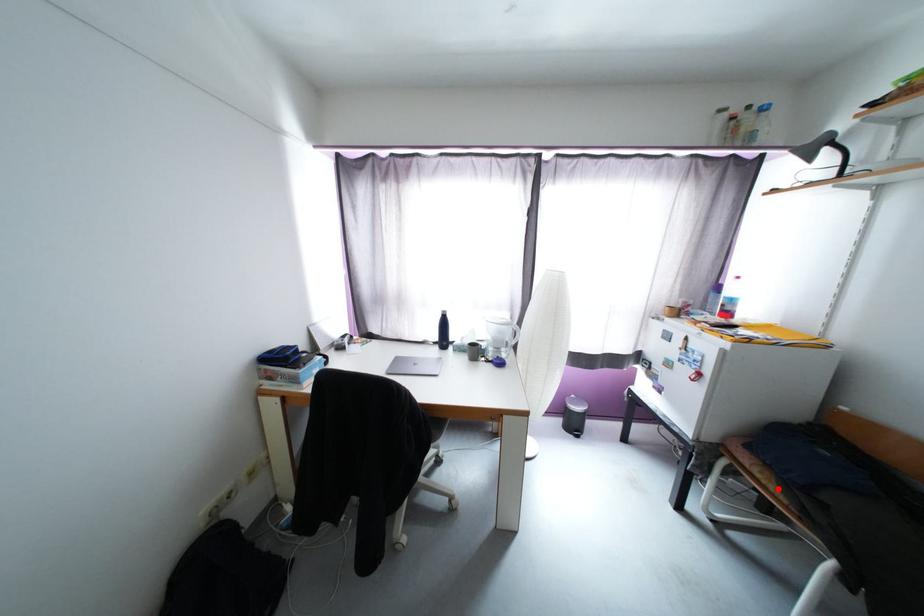
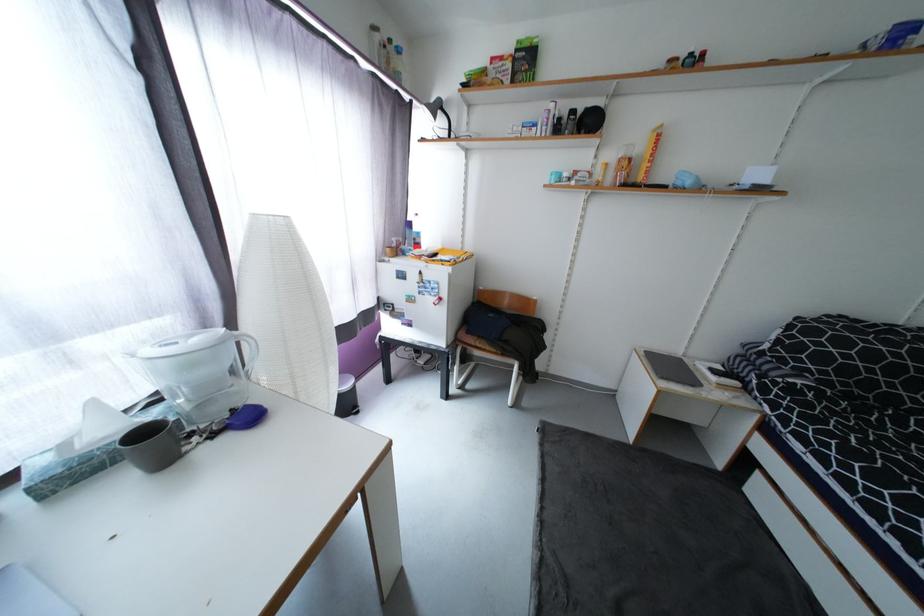
In the second image, find the point that corresponds to the highlighted location in the first image.

(493, 349)